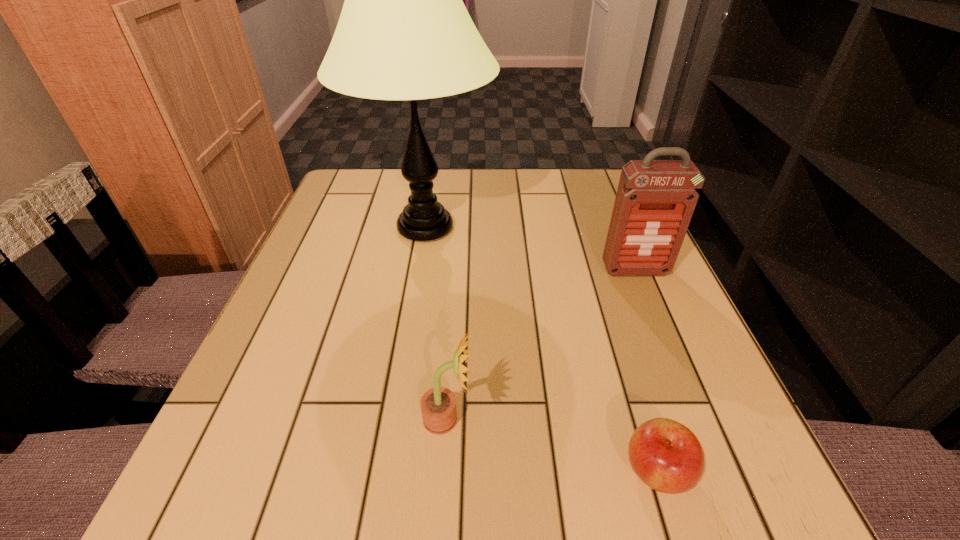
Find the location of a particular element. The height and width of the screenshot is (540, 960). object that is at the left edge is located at coordinates (404, 33).

This screenshot has width=960, height=540. What are the coordinates of `the first-aid kit situated at the right edge` in the screenshot? It's located at (655, 200).

This screenshot has width=960, height=540. In order to click on apple that is at the right edge in this screenshot , I will do `click(667, 456)`.

The width and height of the screenshot is (960, 540). Find the location of `object that is at the far left corner`. object that is at the far left corner is located at coordinates (404, 33).

Where is `object positioned at the near right corner`? This screenshot has width=960, height=540. object positioned at the near right corner is located at coordinates (667, 456).

Locate an element on the screen. This screenshot has height=540, width=960. vacant region at the far edge of the desktop is located at coordinates (540, 181).

Image resolution: width=960 pixels, height=540 pixels. What are the coordinates of `vacant area at the near edge` in the screenshot? It's located at (349, 496).

This screenshot has width=960, height=540. I want to click on free point at the left edge, so click(x=314, y=355).

At what (x,y) coordinates should I click in order to perform the action: click on free space at the right edge of the desktop. Please return your answer as a coordinate pair (x, y). Looking at the image, I should click on (698, 364).

Find the location of `vacant region at the near left corner of the desktop`. vacant region at the near left corner of the desktop is located at coordinates (208, 515).